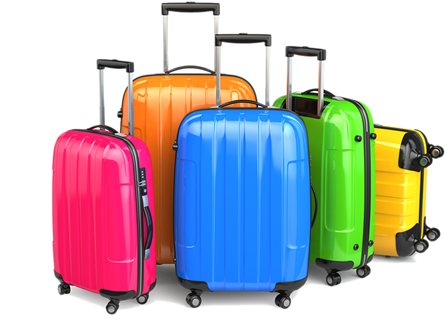
The image size is (445, 330). I want to click on handle, so click(250, 37), click(116, 63), click(182, 7), click(316, 55), click(102, 124), click(185, 67), click(253, 100), click(312, 93).